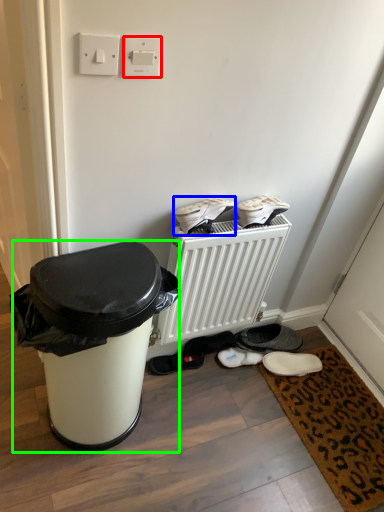
Question: Considering the real-world distances, which object is farthest from electric outlet (highlighted by a red box)? footwear (highlighted by a blue box) or waste container (highlighted by a green box)?

Choices:
 (A) footwear
 (B) waste container

Answer: (B)